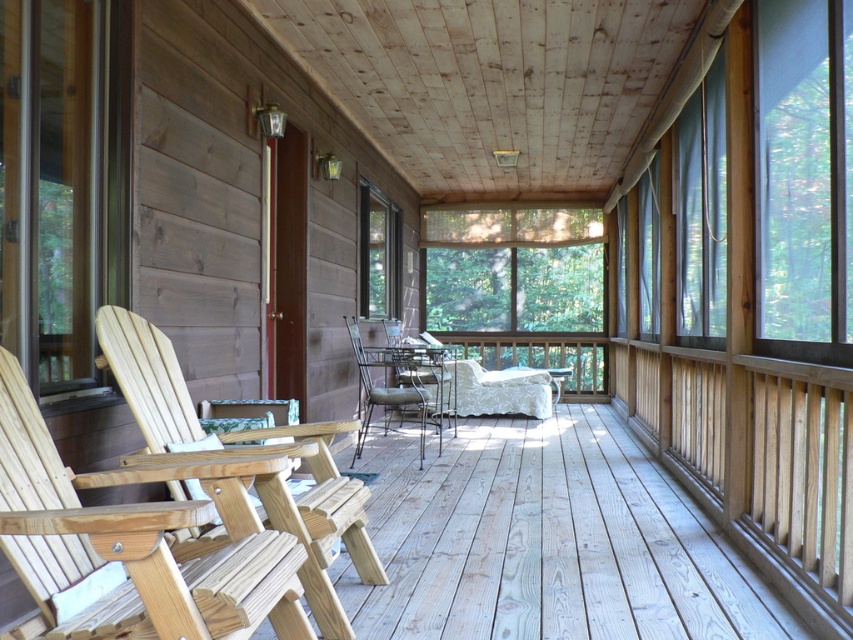
Is point (231, 452) farther from viewer compared to point (444, 358)?

No.

Is light brown wood chair at left above metallic wire chair at center?

Yes.

The image size is (853, 640). Identify the location of light brown wood chair at left. (244, 456).

From the picture: Is metallic silver chair at center taller than metallic wire chair at center?

Yes.

Is metallic silver chair at center positioned behind metallic wire chair at center?

No, metallic silver chair at center is closer to the viewer.

Is point (419, 412) more distant than point (433, 348)?

Yes, it is behind point (433, 348).

Identify the location of metallic silver chair at center. This screenshot has height=640, width=853. click(396, 387).

Who is positioned more to the right, light brown wood chair at left or metallic silver chair at center?

metallic silver chair at center is more to the right.

Which of these two, light brown wood chair at left or metallic silver chair at center, stands shorter?

light brown wood chair at left

Based on the photo, who is more forward, (335, 612) or (408, 396)?

Point (335, 612) is more forward.

This screenshot has width=853, height=640. Identify the location of light brown wood chair at left. (244, 456).